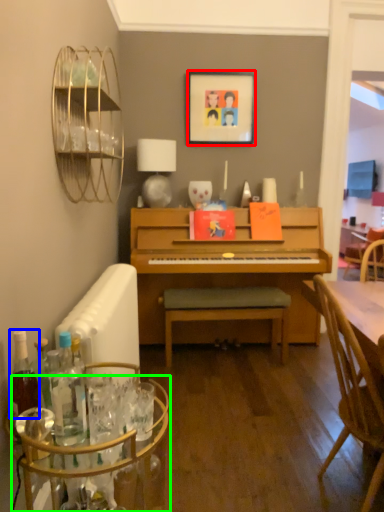
Question: Which is farther away from picture frame (highlighted by a red box)? bottle (highlighted by a blue box) or glass table (highlighted by a green box)?

Choices:
 (A) bottle
 (B) glass table

Answer: (A)